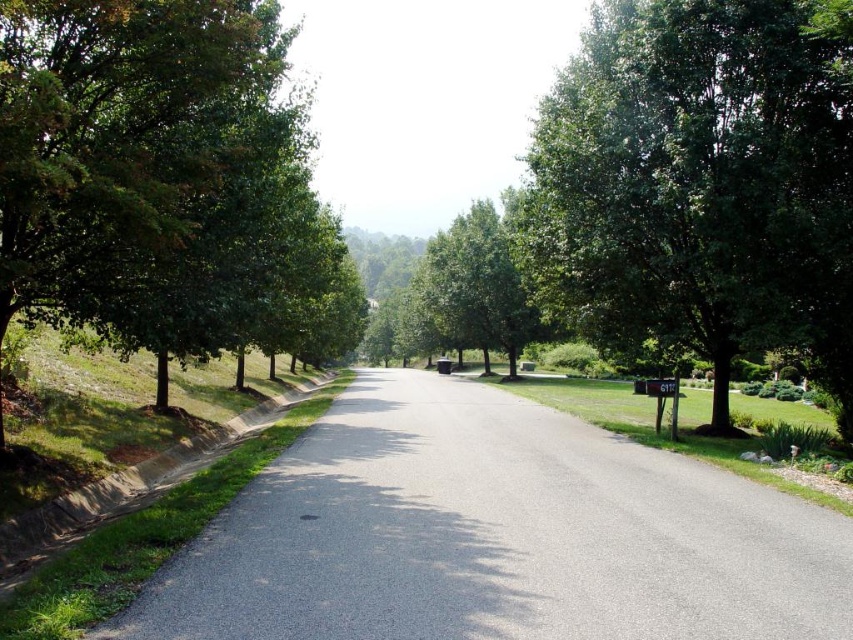
Question: Which object appears farthest from the camera in this image?

Choices:
 (A) green leafy tree at right
 (B) green leafy tree at left
 (C) green leafy tree at center
 (D) gray asphalt road at center

Answer: (C)

Question: Which of the following is the closest to the observer?

Choices:
 (A) green leafy tree at right
 (B) green leafy tree at center
 (C) gray asphalt road at center
 (D) green leafy tree at left

Answer: (C)

Question: Is gray asphalt road at center above green leafy tree at right?

Choices:
 (A) yes
 (B) no

Answer: (B)

Question: Among these objects, which one is farthest from the camera?

Choices:
 (A) green leafy tree at right
 (B) gray asphalt road at center
 (C) green leafy tree at left
 (D) green leafy tree at center

Answer: (D)

Question: Can you confirm if gray asphalt road at center is bigger than green leafy tree at left?

Choices:
 (A) no
 (B) yes

Answer: (A)

Question: Can you confirm if gray asphalt road at center is positioned above green leafy tree at right?

Choices:
 (A) yes
 (B) no

Answer: (B)